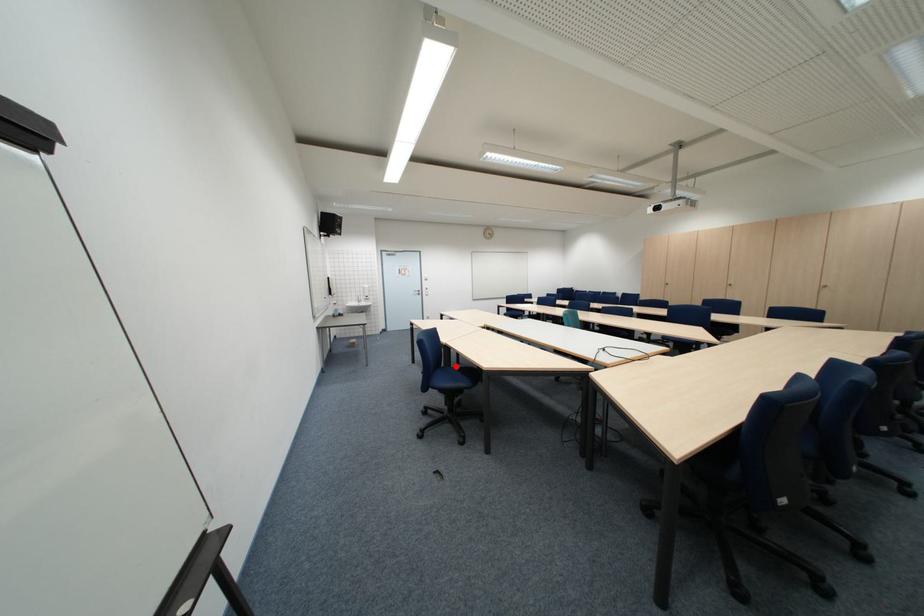
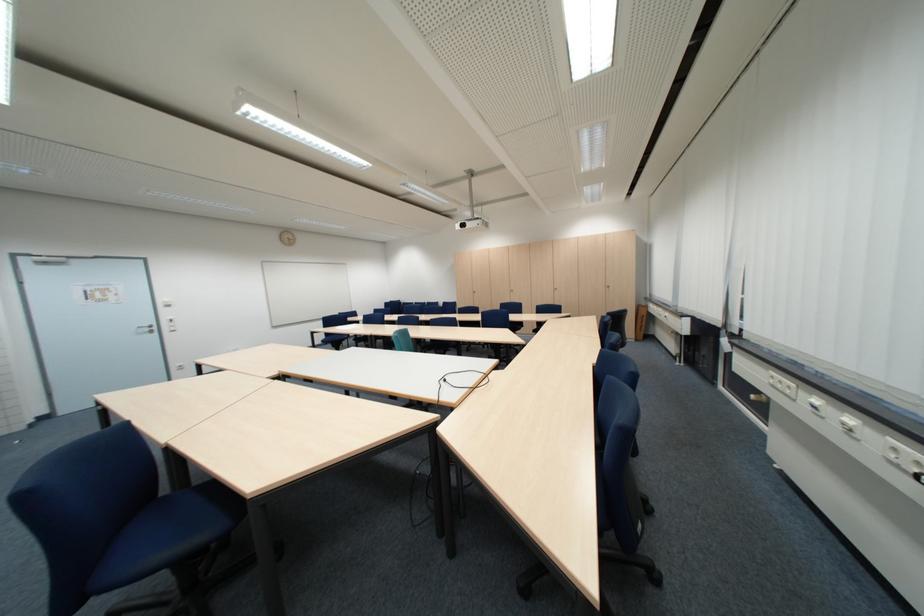
Where in the second image is the point corresponding to the highlighted location from the first image?

(177, 492)